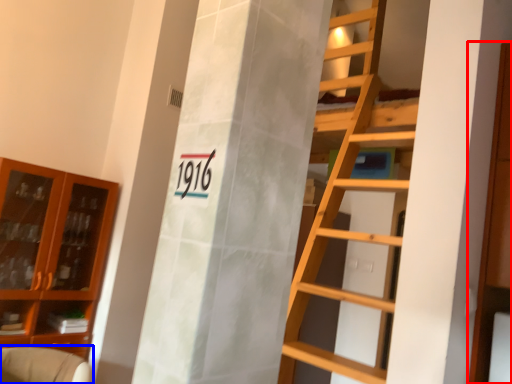
Question: Which of the following is the farthest to the observer, cabinetry (highlighted by a red box) or armchair (highlighted by a blue box)?

Choices:
 (A) cabinetry
 (B) armchair

Answer: (B)